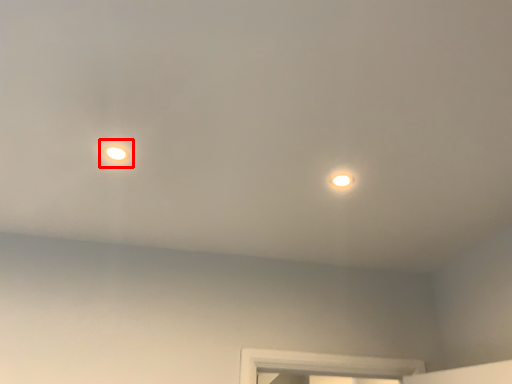
Question: Observing the image, what is the correct spatial positioning of droplight (annotated by the red box) in reference to light?

Choices:
 (A) right
 (B) left

Answer: (B)